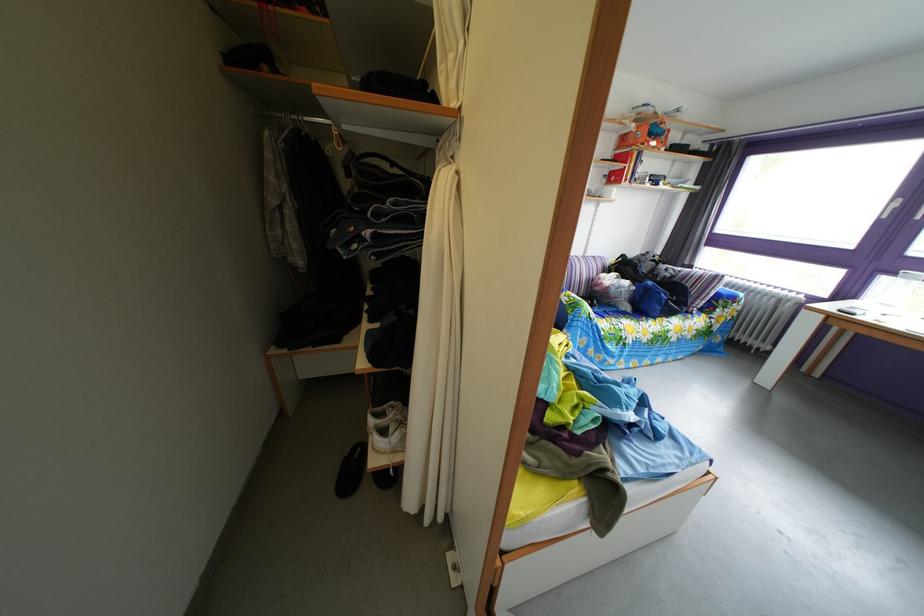
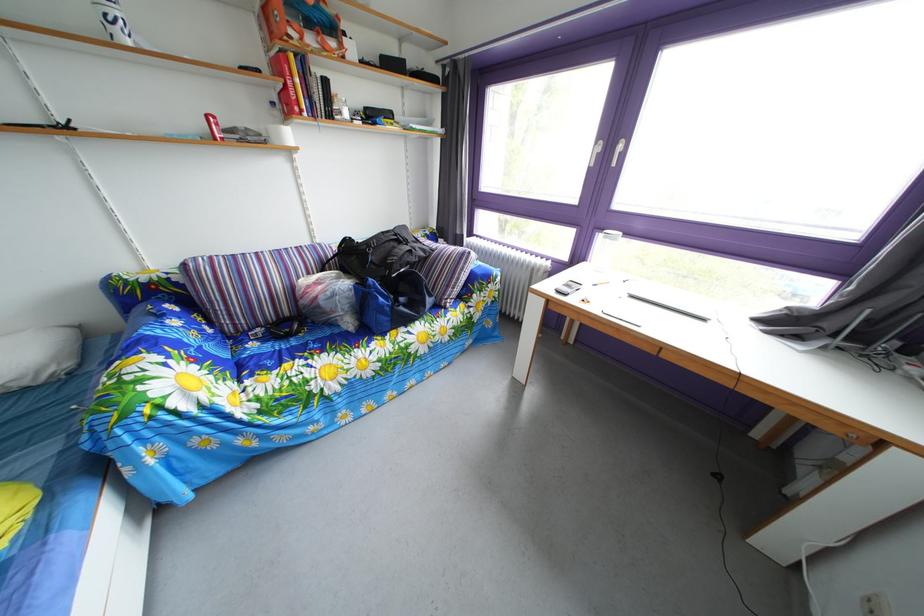
In a continuous first-person perspective shot, in which direction is the camera moving?

The cameraman walked toward right, forward.